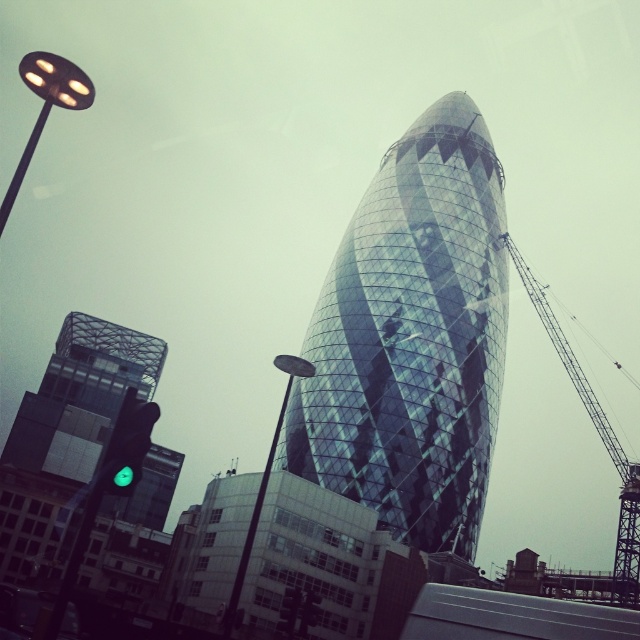
Question: Does glassy modern building at left appear over metallic gray crane at right?

Choices:
 (A) no
 (B) yes

Answer: (A)

Question: Is glassy reflective tower at center further to camera compared to metallic gray crane at right?

Choices:
 (A) no
 (B) yes

Answer: (B)

Question: Among these points, which one is nearest to the camera?

Choices:
 (A) (65, 524)
 (B) (333, 337)
 (C) (148, 440)
 (D) (618, 458)

Answer: (C)

Question: Which object appears closest to the camera in this image?

Choices:
 (A) green glass traffic light at lower left
 (B) glassy modern building at left

Answer: (A)

Question: Where is glassy modern building at left located in relation to metallic gray crane at right in the image?

Choices:
 (A) below
 (B) above

Answer: (A)

Question: Which of the following is the farthest from the observer?

Choices:
 (A) (499, 324)
 (B) (621, 528)
 (C) (141, 403)

Answer: (A)